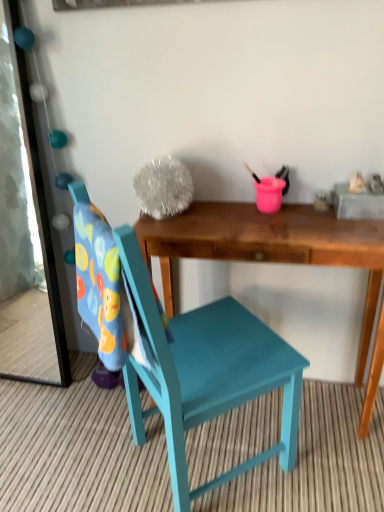
Locate an element on the screen. The image size is (384, 512). free point below teal painted wood chair at center (from a real-world perspective) is located at coordinates (206, 459).